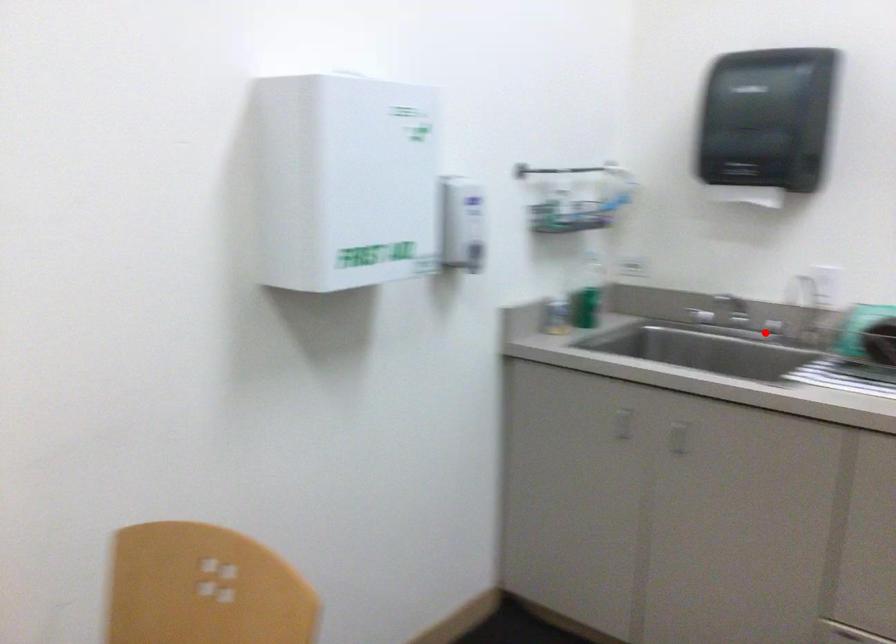
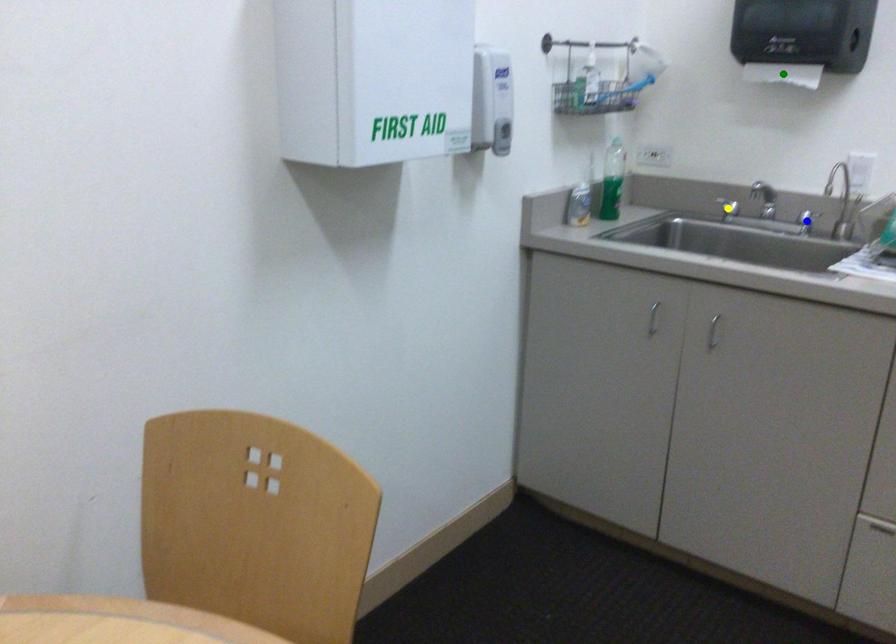
Question: I am providing you with two images of the same scene from different viewpoints. A red point is marked on the first image. You are given multiple points on the second image. Which spot in image 2 lines up with the point in image 1?

Choices:
 (A) yellow point
 (B) blue point
 (C) green point

Answer: (B)